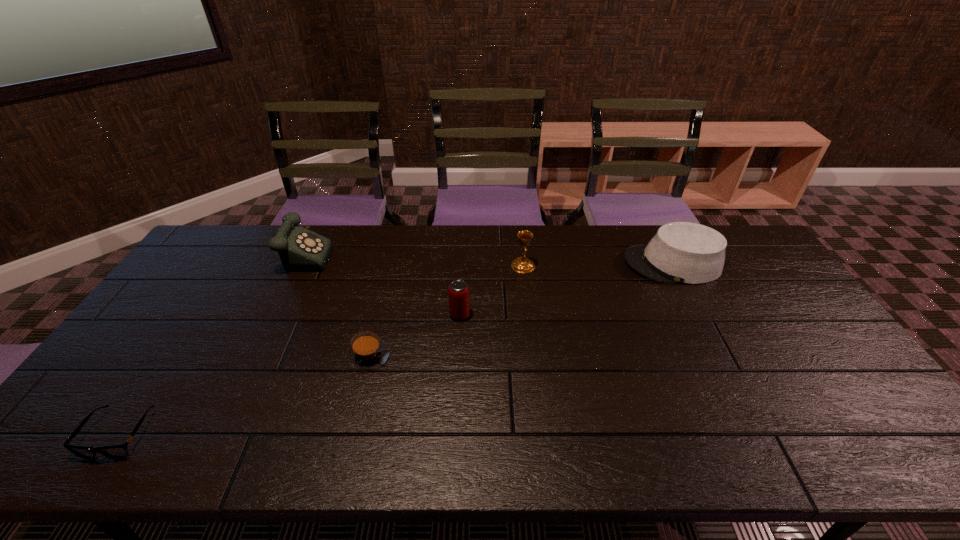
At what (x,y) coordinates should I click in order to perform the action: click on object that is at the left edge. Please return your answer as a coordinate pair (x, y). This screenshot has width=960, height=540. Looking at the image, I should click on (118, 451).

I want to click on object that is at the right edge, so click(680, 252).

At what (x,y) coordinates should I click in order to perform the action: click on object that is at the near left corner. Please return your answer as a coordinate pair (x, y). Looking at the image, I should click on (118, 451).

What are the coordinates of `object at the far right corner` in the screenshot? It's located at (680, 252).

Where is `free space at the far edge of the desktop`? The image size is (960, 540). free space at the far edge of the desktop is located at coordinates (441, 233).

The width and height of the screenshot is (960, 540). I want to click on vacant space at the near edge of the desktop, so click(351, 457).

Where is `vacant space at the right edge`? Image resolution: width=960 pixels, height=540 pixels. vacant space at the right edge is located at coordinates (864, 418).

Where is `free location at the far left corner of the desktop`? The width and height of the screenshot is (960, 540). free location at the far left corner of the desktop is located at coordinates (248, 238).

What are the coordinates of `free space at the far right corner of the desktop` in the screenshot? It's located at (741, 226).

At what (x,y) coordinates should I click in order to perform the action: click on free spot between the second shortest object and the telephone. Please return your answer as a coordinate pair (x, y). Looking at the image, I should click on (337, 303).